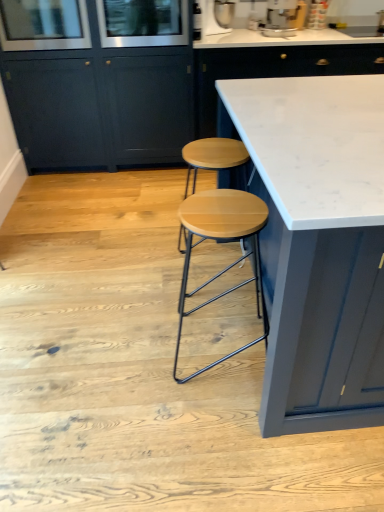
Question: In terms of height, does clear glass screen door at upper left, which ranks as the first screen door in left-to-right order, look taller or shorter compared to wooden seat stool at center?

Choices:
 (A) short
 (B) tall

Answer: (A)

Question: Does point (14, 13) appear closer or farther from the camera than point (225, 357)?

Choices:
 (A) farther
 (B) closer

Answer: (A)

Question: Estimate the real-world distances between objects in this image. Which object is farther from the white marble countertop at center, which ranks as the second cabinetry in left-to-right order?

Choices:
 (A) matte dark blue cabinet at center, which is the 2th cabinetry in right-to-left order
 (B) clear glass screen door at upper left, which ranks as the first screen door in left-to-right order
 (C) metallic silver stand mixer at upper center, marked as the 2th appliance in a right-to-left arrangement
 (D) clear glass screen door at upper center, the 1th screen door in the right-to-left sequence
 (E) metallic silver coffee machine at upper center, which is counted as the second appliance, starting from the left

Answer: (B)

Question: Based on their relative distances, which object is farther from the clear glass screen door at upper left, acting as the 2th screen door starting from the right?

Choices:
 (A) metallic silver coffee machine at upper center, the first appliance when ordered from right to left
 (B) matte dark blue cabinet at center, acting as the first cabinetry starting from the left
 (C) white marble countertop at center
 (D) white marble countertop at center, the 1th cabinetry viewed from the right
 (E) clear glass screen door at upper center, the 1th screen door in the right-to-left sequence

Answer: (C)